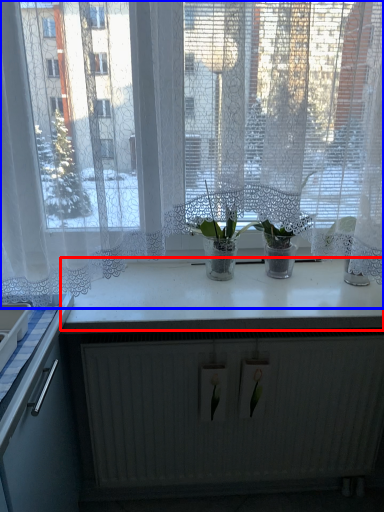
Question: Among these objects, which one is farthest to the camera, counter top (highlighted by a red box) or window (highlighted by a blue box)?

Choices:
 (A) counter top
 (B) window

Answer: (A)